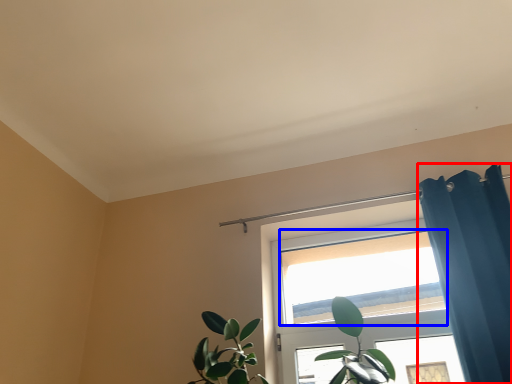
Question: Which point is further to the camera, shower curtain (highlighted by a red box) or window (highlighted by a blue box)?

Choices:
 (A) shower curtain
 (B) window

Answer: (B)